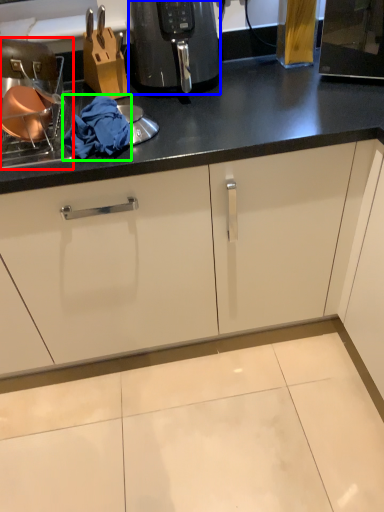
Question: Based on their relative distances, which object is nearer to appliance (highlighted by a red box)? Choose from home appliance (highlighted by a blue box) and material (highlighted by a green box).

Choices:
 (A) home appliance
 (B) material

Answer: (B)